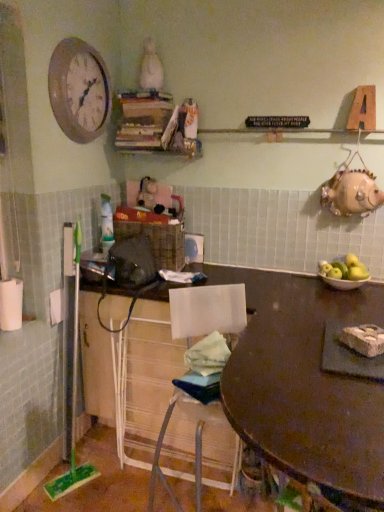
Question: In terms of height, does white crumbly food at table look taller or shorter compared to white wire mesh cabinet at lower center?

Choices:
 (A) tall
 (B) short

Answer: (B)

Question: From the image's perspective, is white crumbly food at table above or below white wire mesh cabinet at lower center?

Choices:
 (A) above
 (B) below

Answer: (A)

Question: Which object is the farthest from the wooden table at center?

Choices:
 (A) green matte apples at right
 (B) white crumbly food at table
 (C) wooden clock at upper left
 (D) matte white bowl at right
 (E) white wire mesh cabinet at lower center

Answer: (C)

Question: Estimate the real-world distances between objects in this image. Which object is farther from the wooden table at center?

Choices:
 (A) matte white bowl at right
 (B) wooden clock at upper left
 (C) white crumbly food at table
 (D) white wire mesh cabinet at lower center
 (E) green matte apples at right

Answer: (B)